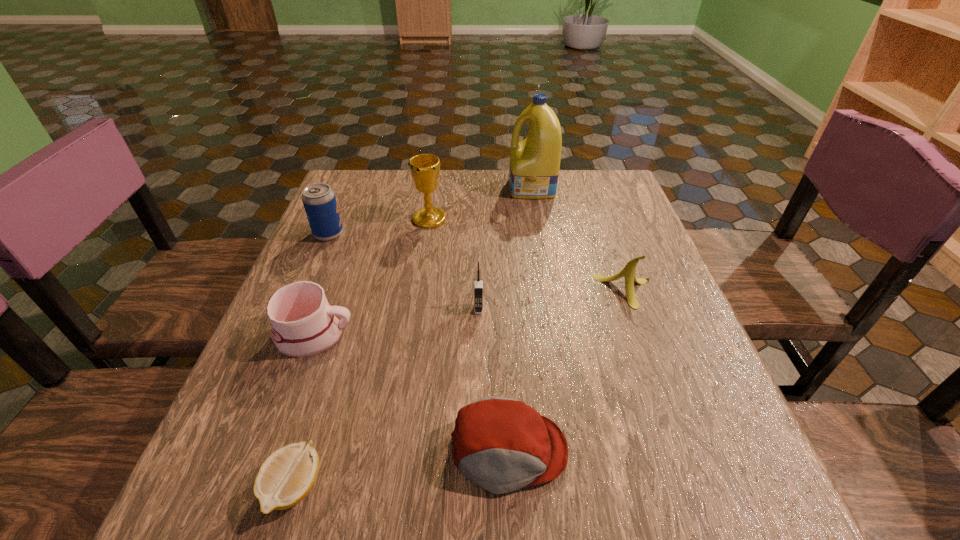
Locate an element on the screen. Image resolution: width=960 pixels, height=540 pixels. free space that is in between the cap and the beer can is located at coordinates (419, 342).

Find the location of a particular element. This screenshot has width=960, height=540. vacant area between the farthest object and the lemon is located at coordinates (413, 338).

Find the location of a particular element. This screenshot has height=540, width=960. unoccupied area between the cellular telephone and the tallest object is located at coordinates (505, 249).

Find the location of `free area in between the fourth object from left to right and the mug`. free area in between the fourth object from left to right and the mug is located at coordinates (372, 277).

Identify the location of the second closest object to the shortest object. (501, 444).

At what (x,y) coordinates should I click in order to perform the action: click on object that can be found as the second closest to the beer can. Please return your answer as a coordinate pair (x, y). This screenshot has width=960, height=540. Looking at the image, I should click on (303, 323).

Where is `vacant point that satisfies the following two spatial constraints: 1. on the front side of the rightmost object; 2. on the right side of the seventh shortest object`? This screenshot has width=960, height=540. vacant point that satisfies the following two spatial constraints: 1. on the front side of the rightmost object; 2. on the right side of the seventh shortest object is located at coordinates (419, 291).

Image resolution: width=960 pixels, height=540 pixels. I want to click on free space that satisfies the following two spatial constraints: 1. on the label of the detergent; 2. on the front-facing side of the cellular telephone, so click(x=552, y=309).

This screenshot has width=960, height=540. Identify the location of free space that satisfies the following two spatial constraints: 1. on the side with the handle of the lemon; 2. on the right side of the mug. (258, 487).

This screenshot has height=540, width=960. Identify the location of free space that satisfies the following two spatial constraints: 1. on the back side of the shortest object; 2. on the left side of the chalice. (376, 219).